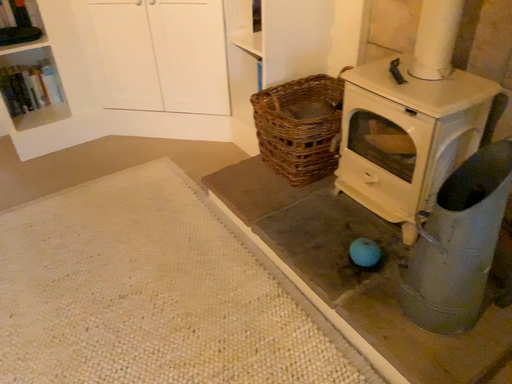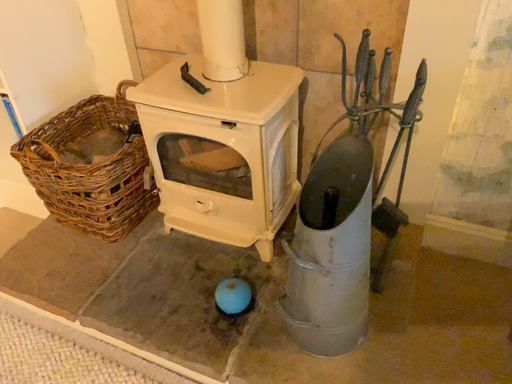
Question: Which way did the camera rotate in the video?

Choices:
 (A) rotated left
 (B) rotated right

Answer: (B)